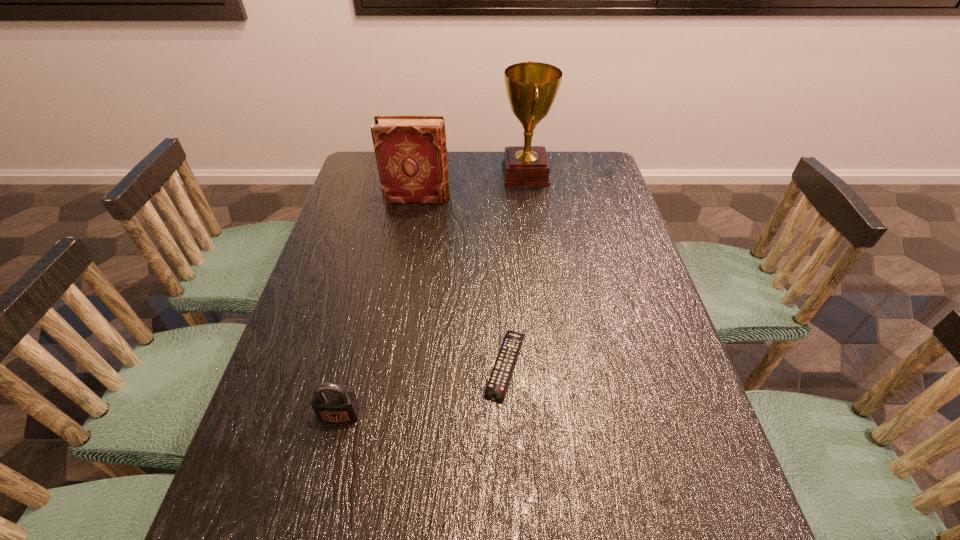
The image size is (960, 540). Find the location of `blank space that satisfies the following two spatial constraints: 1. on the plaque of the award; 2. on the front of the padlock near the keyhole`. blank space that satisfies the following two spatial constraints: 1. on the plaque of the award; 2. on the front of the padlock near the keyhole is located at coordinates (558, 415).